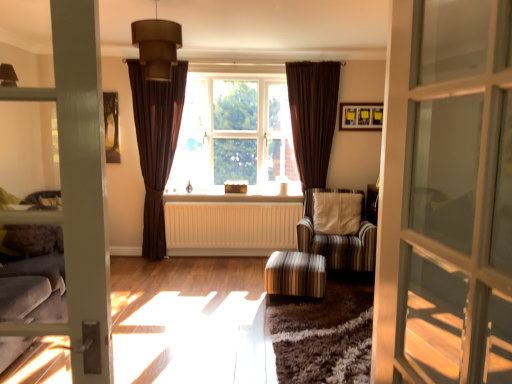
Question: Is brown velvet curtain at right, acting as the 2th curtain starting from the left, not near white painted wood at center?

Choices:
 (A) yes
 (B) no

Answer: (B)

Question: Is brown velvet curtain at right, which ranks as the 1th curtain in right-to-left order, taller than white painted wood at center?

Choices:
 (A) no
 (B) yes

Answer: (B)

Question: Can you confirm if brown velvet curtain at right, which ranks as the 1th curtain in right-to-left order, is thinner than white painted wood at center?

Choices:
 (A) yes
 (B) no

Answer: (A)

Question: Would you say brown velvet curtain at right, acting as the 2th curtain starting from the left, contains white painted wood at center?

Choices:
 (A) no
 (B) yes

Answer: (A)

Question: Does brown velvet curtain at right, acting as the 2th curtain starting from the left, have a smaller size compared to white painted wood at center?

Choices:
 (A) yes
 (B) no

Answer: (B)

Question: Is brown velvet curtain at right, acting as the 2th curtain starting from the left, to the right of white painted wood at center from the viewer's perspective?

Choices:
 (A) no
 (B) yes

Answer: (B)

Question: Is matte black picture frame at upper right positioned with its back to brown fabric window at center?

Choices:
 (A) no
 (B) yes

Answer: (A)

Question: From a real-world perspective, is matte black picture frame at upper right positioned under brown fabric window at center based on gravity?

Choices:
 (A) yes
 (B) no

Answer: (B)

Question: Could brown fabric window at center be considered to be inside matte black picture frame at upper right?

Choices:
 (A) yes
 (B) no

Answer: (B)

Question: Does matte black picture frame at upper right have a greater height compared to brown fabric window at center?

Choices:
 (A) yes
 (B) no

Answer: (B)

Question: Does matte black picture frame at upper right appear on the right side of brown fabric window at center?

Choices:
 (A) yes
 (B) no

Answer: (A)

Question: Is matte black picture frame at upper right far from brown fabric window at center?

Choices:
 (A) no
 (B) yes

Answer: (B)

Question: Considering the relative sizes of brown fabric window at center and brown velvet curtain at right, which ranks as the 1th curtain in right-to-left order, in the image provided, is brown fabric window at center wider than brown velvet curtain at right, which ranks as the 1th curtain in right-to-left order,?

Choices:
 (A) no
 (B) yes

Answer: (B)